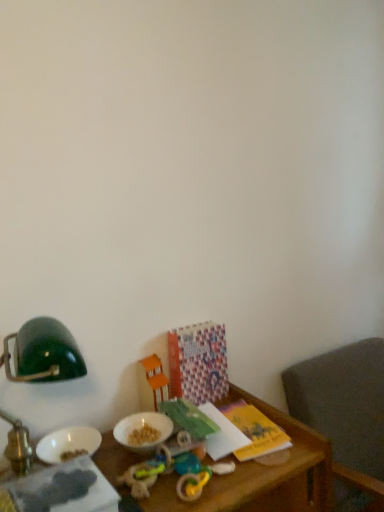
Question: Does point (23, 329) appear closer or farther from the camera than point (139, 471)?

Choices:
 (A) closer
 (B) farther

Answer: (A)

Question: Choose the correct answer: Is green matte lampshade at upper left inside rubber chew toy at lower center, the second toy viewed from the front, or outside it?

Choices:
 (A) inside
 (B) outside

Answer: (B)

Question: Which object is the farthest from the gray fabric chair at lower right?

Choices:
 (A) rubber chew toy at lower center, acting as the second toy starting from the back
 (B) wooden table at lower left
 (C) orange plastic toy house at center, the third toy viewed from the front
 (D) patterned paper calendar at lower center, the 1th book from the right
 (E) matte green book at lower left, which is counted as the 2th book, starting from the right

Answer: (E)

Question: Based on their relative distances, which object is nearer to the green matte lampshade at upper left?

Choices:
 (A) wooden table at lower left
 (B) rubber teething ring at lower center, which is counted as the 3th toy, starting from the back
 (C) patterned paper calendar at lower center, which is the 2th book from front to back
 (D) matte green book at lower left, which is counted as the 2th book, starting from the right
 (E) orange plastic toy house at center, the third toy viewed from the front

Answer: (D)